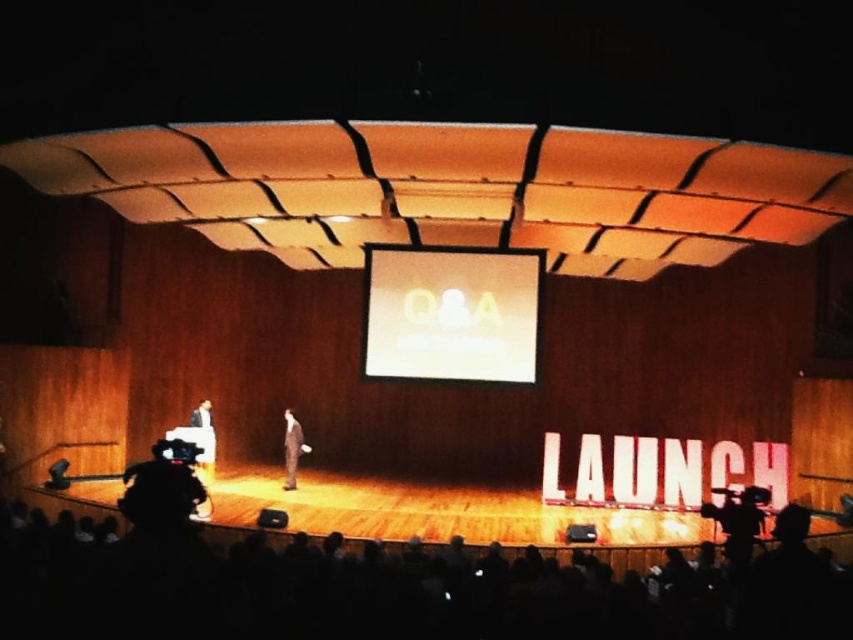
Consider the image. You are a photographer positioned at the front of the auditorium. You want to capture a photo that includes both point A at point (415, 292) and point B at point (206, 419). Which point should you focus on first to ensure both are in sharp focus?

You should focus on point A at point (415, 292) first because it is closer to the camera than point B at point (206, 419). This ensures the closer point is in focus, and the farther point will also be within the depth of field.

You are an event photographer trying to capture a candid shot of both the light brown suit at left and the light brown leather jacket at left. Since you want to include both in the frame, which one should you position your camera closer to in order to ensure both subjects are fully visible?

The light brown suit at left is positioned on the left side of light brown leather jacket at left. To include both in the frame, you should position your camera closer to the light brown suit at left so that you can capture the entire area between them without cropping either subject out.

You are an event planner setting up a camera to capture the white glossy screen at center during the Q and A segment. The camera has a fixed position at point (451,314). Is the camera positioned to capture the screen?

Yes, the camera is positioned exactly at the point indicating the white glossy screen at center, so it will capture the screen.